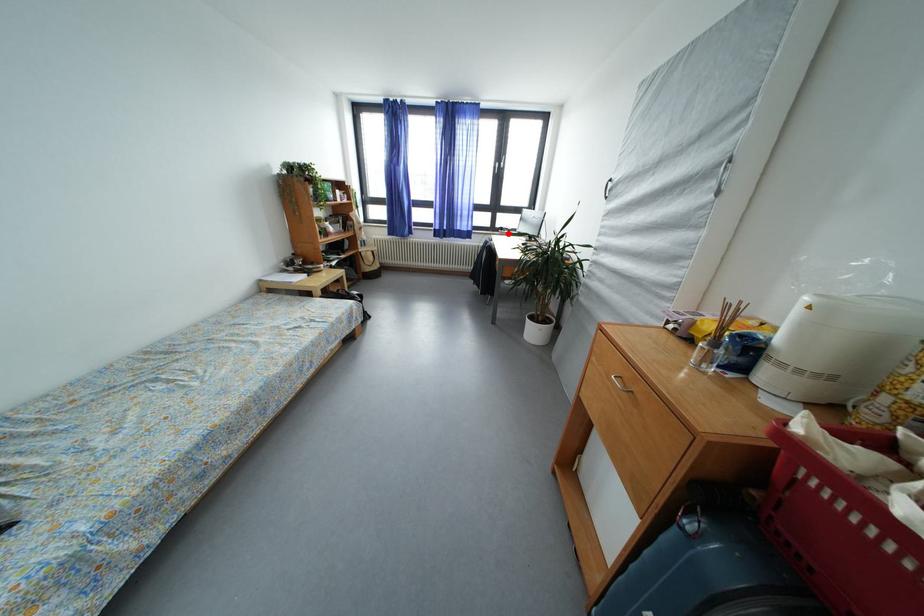
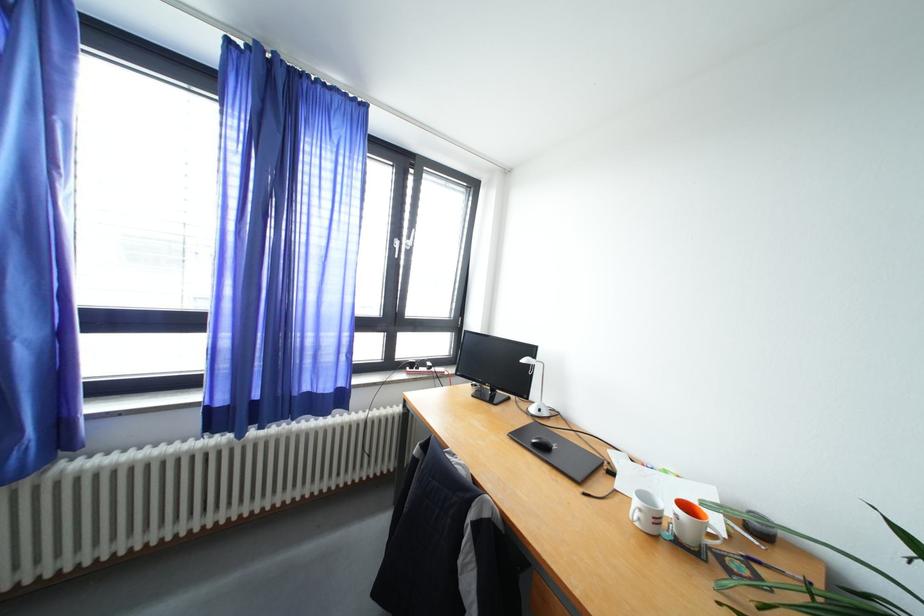
Locate, in the second image, the point that corresponds to the highlighted location in the first image.

(419, 370)